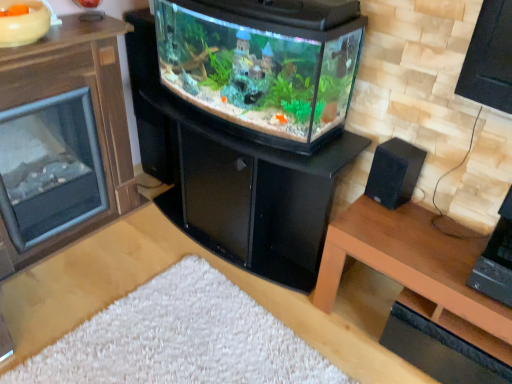
This screenshot has width=512, height=384. Find the location of `free area below brown wood table at lower right (from a real-world perspective)`. free area below brown wood table at lower right (from a real-world perspective) is located at coordinates coord(375,314).